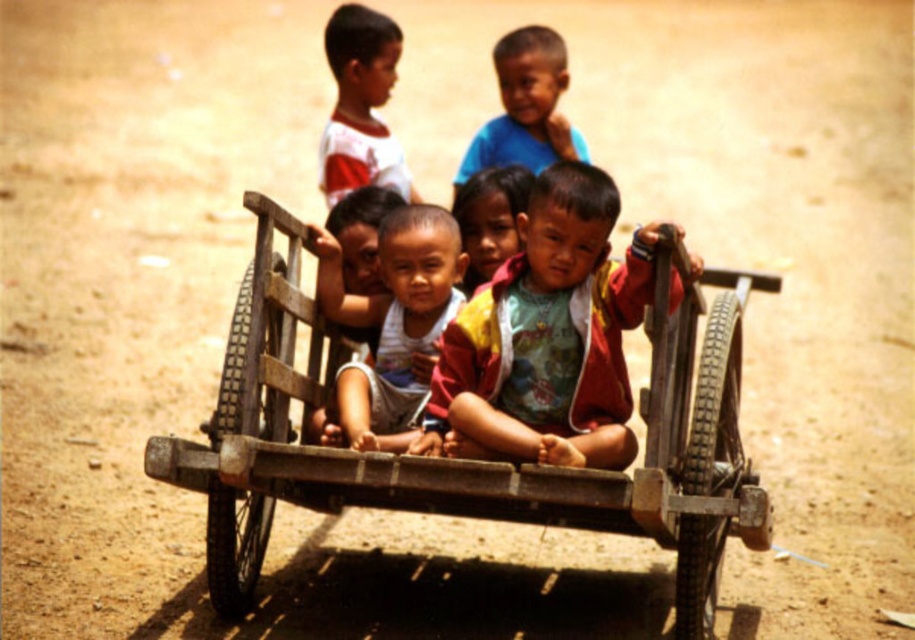
Question: Estimate the real-world distances between objects in this image. Which object is closer to the smooth skin boy at center?

Choices:
 (A) matte skin child at center
 (B) matte white shirt at center
 (C) multicolored fabric shirt at center

Answer: (A)

Question: Which object is positioned closest to the matte white shirt at center?

Choices:
 (A) multicolored fabric shirt at center
 (B) white cotton shirt at upper left
 (C) wooden cart at center
 (D) matte skin child at center

Answer: (A)

Question: Is wooden cart at center smaller than multicolored fabric shirt at center?

Choices:
 (A) no
 (B) yes

Answer: (B)

Question: Can you confirm if white cotton shirt at upper left is positioned to the left of matte skin child at center?

Choices:
 (A) yes
 (B) no

Answer: (A)

Question: Is matte white shirt at center wider than smooth skin boy at center?

Choices:
 (A) no
 (B) yes

Answer: (A)

Question: Among these points, which one is farthest from the camera?

Choices:
 (A) (562, 77)
 (B) (370, 54)
 (C) (375, 355)

Answer: (B)